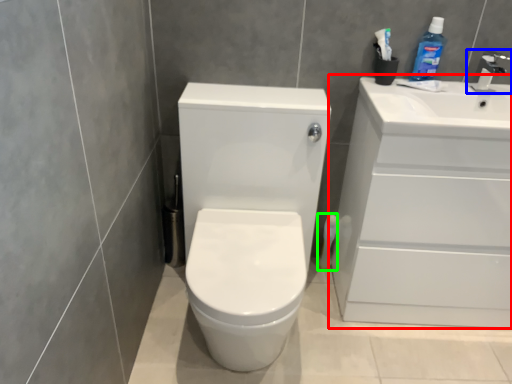
Question: Which object is positioned closest to bathroom cabinet (highlighted by a red box)? Select from tap (highlighted by a blue box) and toilet paper (highlighted by a green box).

Choices:
 (A) tap
 (B) toilet paper

Answer: (A)